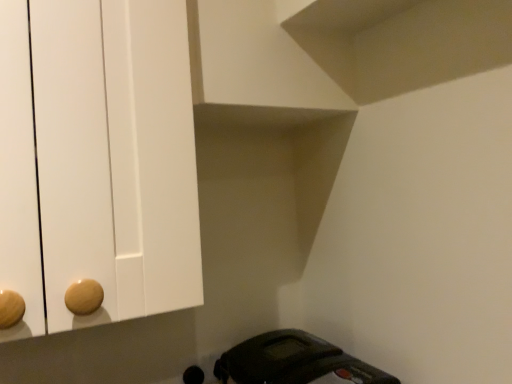
In the scene shown: In order to face black plastic vacuum cleaner at lower right, should I rotate leftwards or rightwards?

Turn right by 6.064 degrees to look at black plastic vacuum cleaner at lower right.

The width and height of the screenshot is (512, 384). I want to click on black plastic vacuum cleaner at lower right, so click(294, 362).

The image size is (512, 384). Describe the element at coordinates (294, 362) in the screenshot. I see `black plastic vacuum cleaner at lower right` at that location.

Locate an element on the screen. This screenshot has height=384, width=512. black plastic vacuum cleaner at lower right is located at coordinates (294, 362).